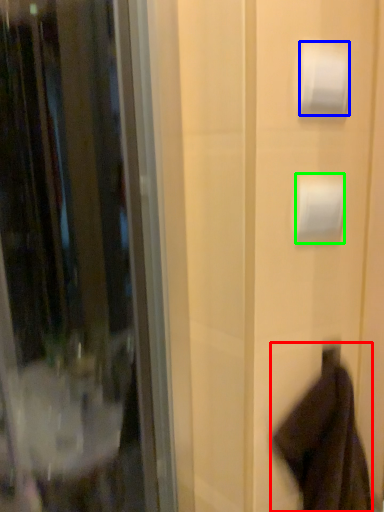
Question: Which object is the farthest from robe (highlighted by a red box)? Choose among these: toilet paper (highlighted by a blue box) or toilet paper (highlighted by a green box).

Choices:
 (A) toilet paper
 (B) toilet paper

Answer: (A)